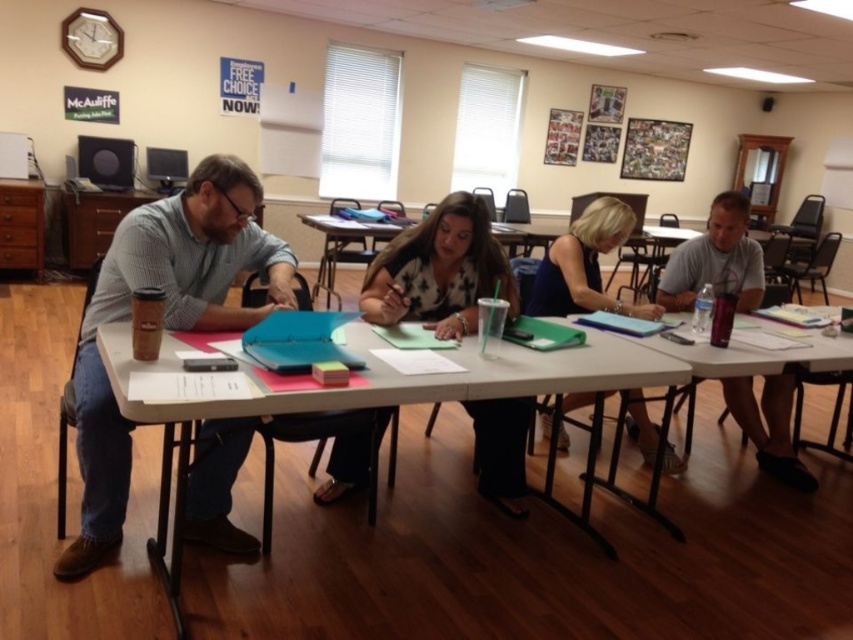
Which is in front, point (509, 385) or point (587, 260)?

Point (509, 385)

Is white plastic table at center below blue fabric dress at center?

Yes, white plastic table at center is below blue fabric dress at center.

Locate an element on the screen. This screenshot has height=640, width=853. white plastic table at center is located at coordinates (379, 392).

Measure the distance between point (450,294) and camera.

Point (450,294) and camera are 2.60 meters apart.

Is matte black woman at center smaller than gray fabric shirt at right?

No, matte black woman at center is not smaller than gray fabric shirt at right.

Which is behind, point (357, 460) or point (775, 445)?

The point (775, 445) is behind.

What are the coordinates of `matte black woman at center` in the screenshot? It's located at (439, 272).

Is clear plastic water bottle at lower right to the left of blue fabric dress at center from the viewer's perspective?

In fact, clear plastic water bottle at lower right is to the right of blue fabric dress at center.

Between point (805, 336) and point (606, 244), which one is positioned behind?

The point (606, 244) is more distant.

What do you see at coordinates (763, 381) in the screenshot? I see `clear plastic water bottle at lower right` at bounding box center [763, 381].

You are a GUI agent. You are given a task and a screenshot of the screen. Output one action in this format:
    pyautogui.click(x=<x>, y=<y>)
    Task: Click on the clear plastic water bottle at lower right
    Image resolution: width=853 pixels, height=640 pixels.
    Given the screenshot: What is the action you would take?
    pyautogui.click(x=763, y=381)